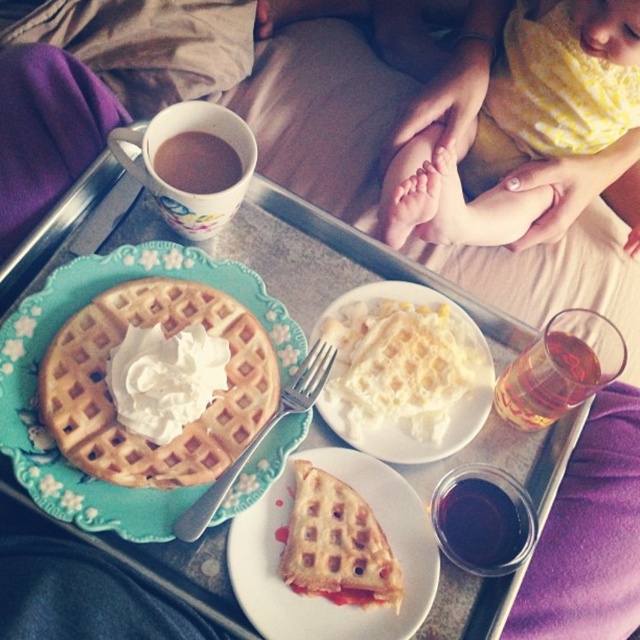
You are setting up a dining table and need to place a napkin between the white matte plate at center and the translucent glass at upper right. Based on their positions, which object should the napkin be closer to?

The white matte plate at center is closer to the viewer than the translucent glass at upper right, so the napkin should be placed closer to the white matte plate at center.

You are setting up a dining table and need to place the white matte plate at center and the dark red liquid at lower right. According to the image, which one should be placed lower on the table?

The white matte plate at center should be placed lower on the table because it is positioned below the dark red liquid at lower right in the image.